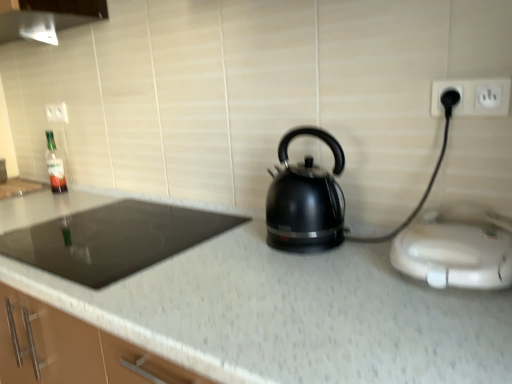
Question: From the image's perspective, is white plastic toaster at right above black glossy kettle at center?

Choices:
 (A) no
 (B) yes

Answer: (A)

Question: Is white plastic toaster at right not within black glossy kettle at center?

Choices:
 (A) yes
 (B) no

Answer: (A)

Question: Is white plastic toaster at right far away from black glossy kettle at center?

Choices:
 (A) yes
 (B) no

Answer: (B)

Question: From a real-world perspective, is white plastic toaster at right under black glossy kettle at center?

Choices:
 (A) yes
 (B) no

Answer: (A)

Question: Does white plastic toaster at right have a greater height compared to black glossy kettle at center?

Choices:
 (A) yes
 (B) no

Answer: (B)

Question: Can you confirm if white plastic toaster at right is wider than black glossy kettle at center?

Choices:
 (A) no
 (B) yes

Answer: (B)

Question: From the image's perspective, is black glass cooktop at left above black plastic electric outlet at upper right, marked as the first electric outlet in a right-to-left arrangement?

Choices:
 (A) no
 (B) yes

Answer: (A)

Question: Is black glass cooktop at left looking in the opposite direction of black plastic electric outlet at upper right, marked as the first electric outlet in a right-to-left arrangement?

Choices:
 (A) yes
 (B) no

Answer: (B)

Question: Is black glass cooktop at left oriented towards black plastic electric outlet at upper right, which is the 2th electric outlet in left-to-right order?

Choices:
 (A) yes
 (B) no

Answer: (B)

Question: Does black glass cooktop at left appear on the left side of black plastic electric outlet at upper right, arranged as the first electric outlet when ordered from the bottom?

Choices:
 (A) yes
 (B) no

Answer: (A)

Question: Is black glass cooktop at left next to black plastic electric outlet at upper right, arranged as the first electric outlet when ordered from the bottom?

Choices:
 (A) yes
 (B) no

Answer: (B)

Question: From the image's perspective, is black glass cooktop at left beneath black plastic electric outlet at upper right, arranged as the first electric outlet when ordered from the bottom?

Choices:
 (A) yes
 (B) no

Answer: (A)

Question: Is white granite countertop at center positioned far away from black glass cooktop at left?

Choices:
 (A) yes
 (B) no

Answer: (B)